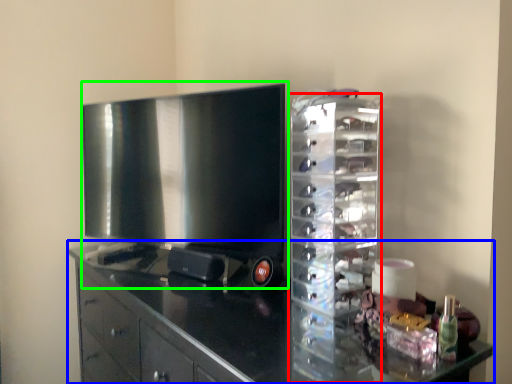
Question: Which is farther away from glass box (highlighted by a red box)? cabinetry (highlighted by a blue box) or home appliance (highlighted by a green box)?

Choices:
 (A) cabinetry
 (B) home appliance

Answer: (B)